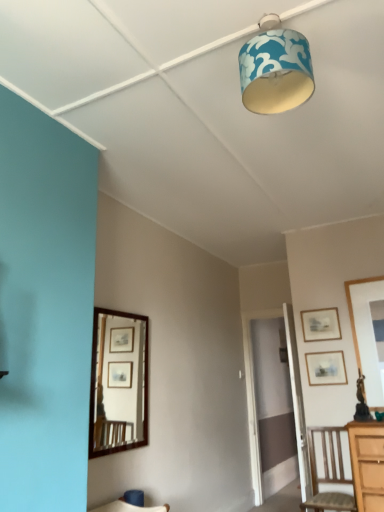
Question: Does brown wooden mirror at left have a lesser height compared to blue fabric lampshade at upper center?

Choices:
 (A) no
 (B) yes

Answer: (A)

Question: Is brown wooden mirror at left oriented away from blue fabric lampshade at upper center?

Choices:
 (A) no
 (B) yes

Answer: (A)

Question: From a real-world perspective, does brown wooden mirror at left sit lower than blue fabric lampshade at upper center?

Choices:
 (A) no
 (B) yes

Answer: (B)

Question: Considering the relative positions of brown wooden mirror at left and blue fabric lampshade at upper center in the image provided, is brown wooden mirror at left in front of blue fabric lampshade at upper center?

Choices:
 (A) yes
 (B) no

Answer: (B)

Question: Is blue fabric lampshade at upper center completely or partially inside brown wooden mirror at left?

Choices:
 (A) yes
 (B) no

Answer: (B)

Question: Is brown wooden mirror at left further to the viewer compared to blue fabric lampshade at upper center?

Choices:
 (A) no
 (B) yes

Answer: (B)

Question: Is brown wooden mirror at left aimed at wooden picture frame at upper right, the second picture frame ordered from the bottom?

Choices:
 (A) yes
 (B) no

Answer: (B)

Question: Is wooden picture frame at upper right, positioned as the first picture frame in top-to-bottom order, inside brown wooden mirror at left?

Choices:
 (A) no
 (B) yes

Answer: (A)

Question: From the image's perspective, is brown wooden mirror at left on wooden picture frame at upper right, the second picture frame ordered from the bottom?

Choices:
 (A) yes
 (B) no

Answer: (B)

Question: Does brown wooden mirror at left come behind wooden picture frame at upper right, positioned as the first picture frame in top-to-bottom order?

Choices:
 (A) yes
 (B) no

Answer: (B)

Question: From the image's perspective, would you say brown wooden mirror at left is shown under wooden picture frame at upper right, positioned as the first picture frame in top-to-bottom order?

Choices:
 (A) yes
 (B) no

Answer: (A)

Question: Is brown wooden mirror at left shorter than wooden picture frame at upper right, positioned as the first picture frame in top-to-bottom order?

Choices:
 (A) no
 (B) yes

Answer: (A)

Question: From the image's perspective, is matte wooden picture frame at right, positioned as the 2th picture frame in top-to-bottom order, under wooden picture frame at upper right, positioned as the first picture frame in top-to-bottom order?

Choices:
 (A) yes
 (B) no

Answer: (A)